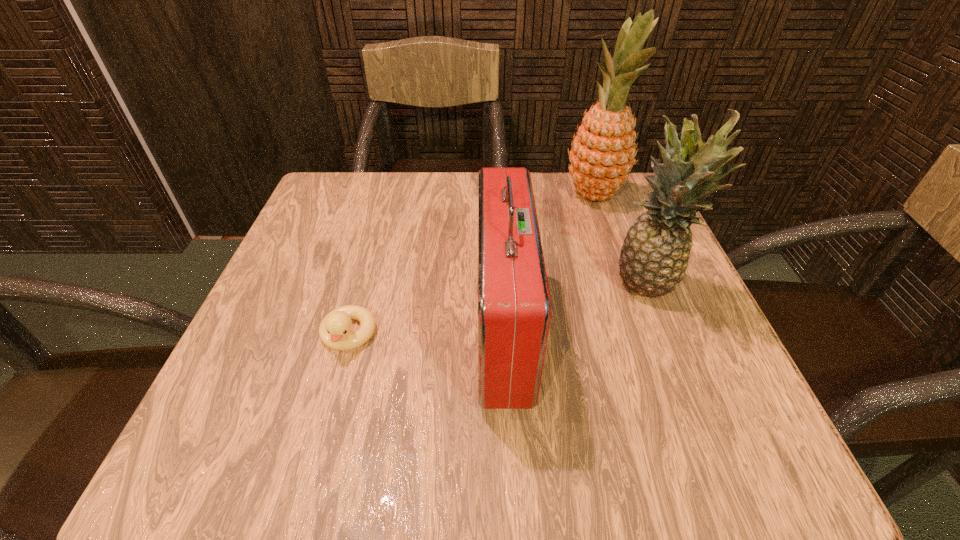
You are a GUI agent. You are given a task and a screenshot of the screen. Output one action in this format:
    pyautogui.click(x=<x>, y=<y>)
    Task: Click on the free location located 0.360m on the side of the second object from left to right with the first aid cross symbol
    
    Given the screenshot: What is the action you would take?
    pyautogui.click(x=256, y=330)

Find the location of a particular element. This screenshot has height=540, width=960. vacant space positioned 0.350m on the side of the second object from left to right with the first aid cross symbol is located at coordinates (262, 330).

Identify the location of vacant space situated on the side of the second object from left to right with the first aid cross symbol. This screenshot has width=960, height=540. point(398,330).

You are a GUI agent. You are given a task and a screenshot of the screen. Output one action in this format:
    pyautogui.click(x=<x>, y=<y>)
    Task: Click on the vacant space located at the beak of the leftmost object
    This screenshot has width=960, height=540.
    Given the screenshot: What is the action you would take?
    pyautogui.click(x=325, y=414)

The height and width of the screenshot is (540, 960). Identify the location of object that is positioned at the far edge. (603, 153).

Where is `object that is at the near edge`? object that is at the near edge is located at coordinates (514, 307).

Find the location of a particular element. Image resolution: width=960 pixels, height=540 pixels. object present at the left edge is located at coordinates (334, 331).

Identify the location of object present at the far right corner. (603, 153).

Find the location of a particular element. blank space at the far edge is located at coordinates click(x=386, y=217).

This screenshot has width=960, height=540. What are the coordinates of `vacant space at the near edge` in the screenshot? It's located at (422, 427).